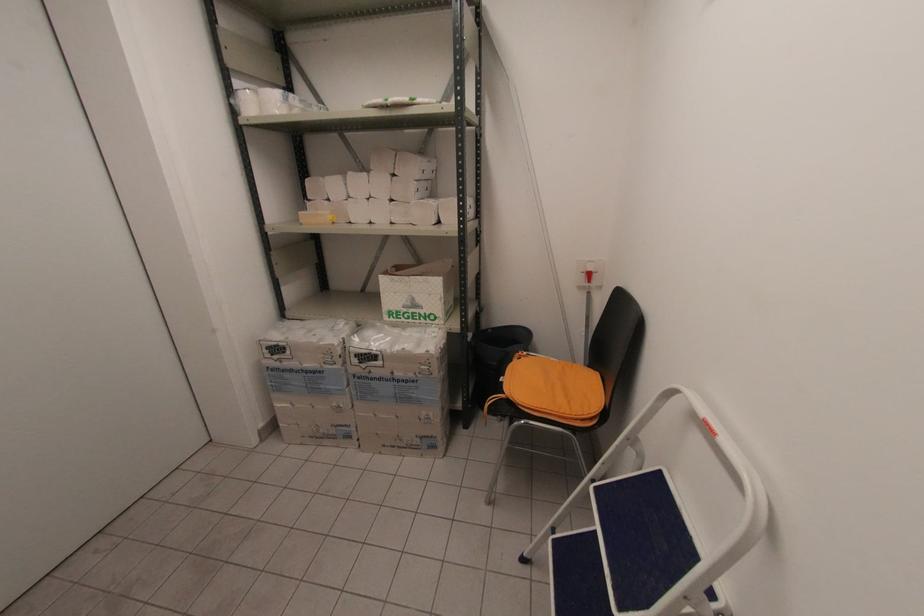
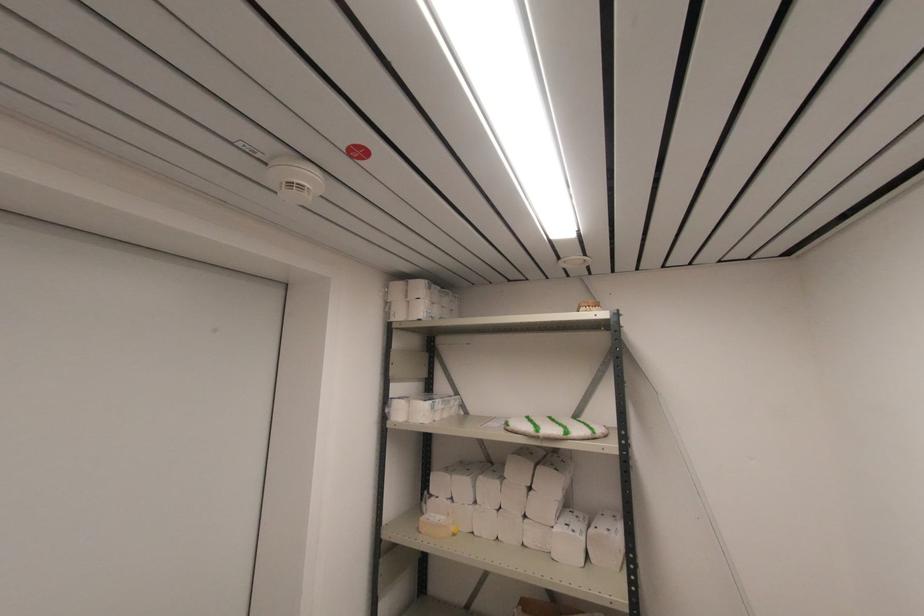
Where in the second image is the point corresponding to (302,225) from the first image?

(420, 533)